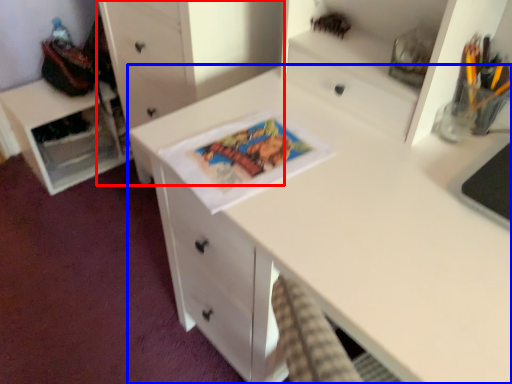
Question: Which point is closer to the camera, chest of drawers (highlighted by a red box) or desk (highlighted by a blue box)?

Choices:
 (A) chest of drawers
 (B) desk

Answer: (B)